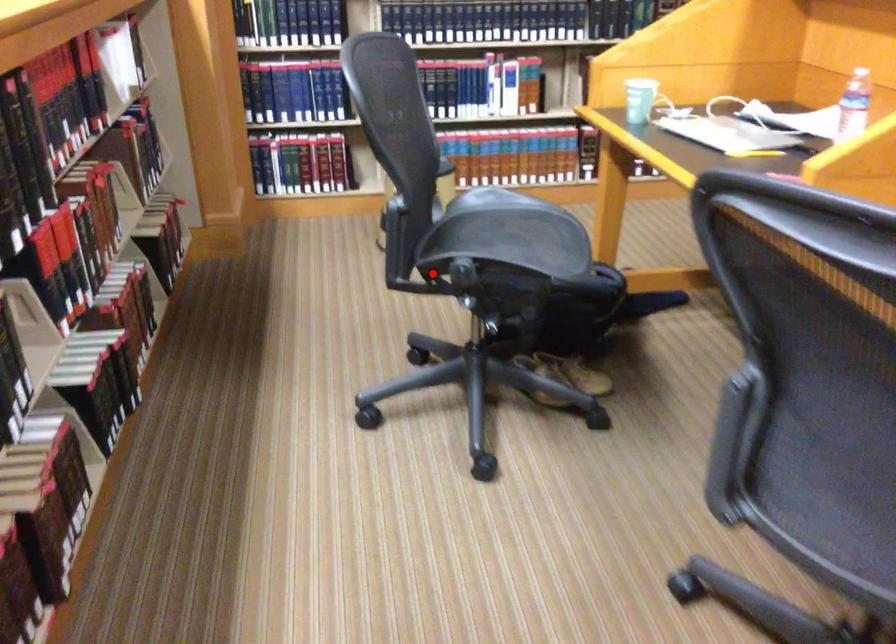
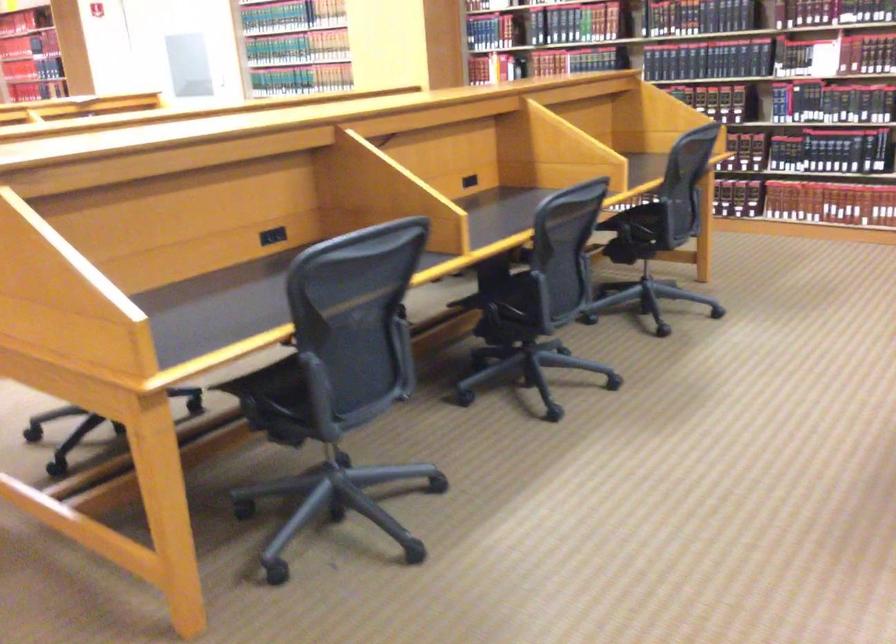
Question: I am providing you with two images of the same scene from different viewpoints. A red point is marked on the first image. Can you still see the location of the red point in image 2?

Choices:
 (A) Yes
 (B) No

Answer: (B)